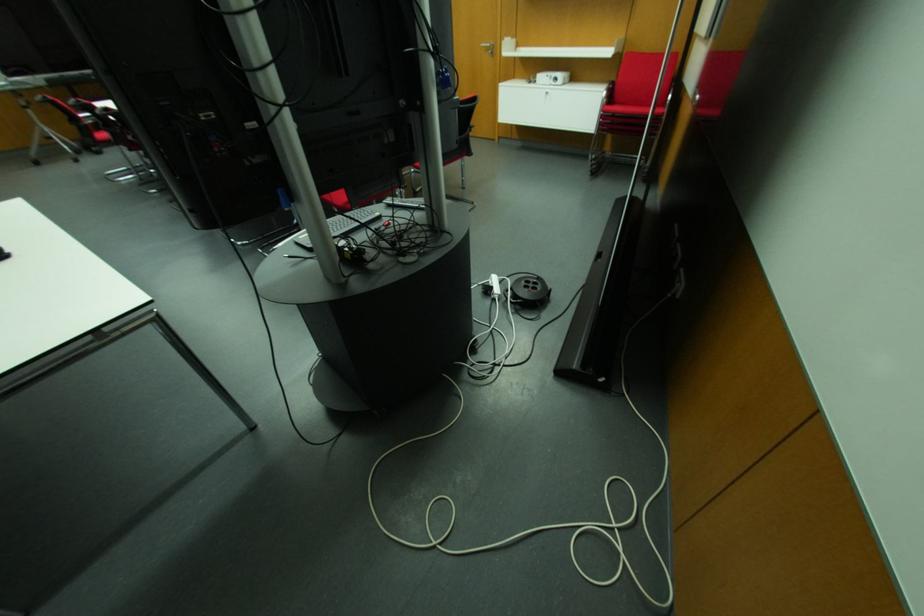
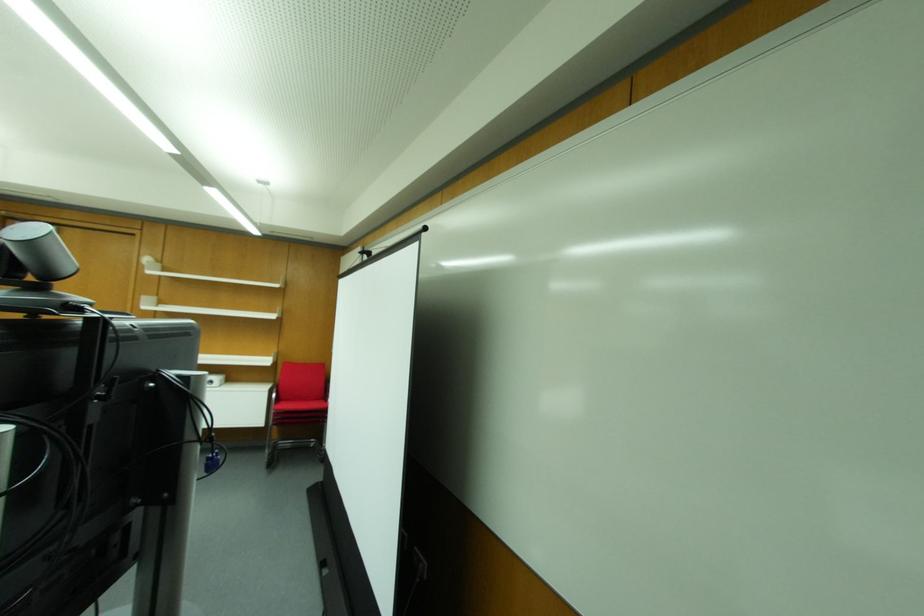
Locate, in the second image, the point that corresponds to (604,92) in the first image.

(274, 394)